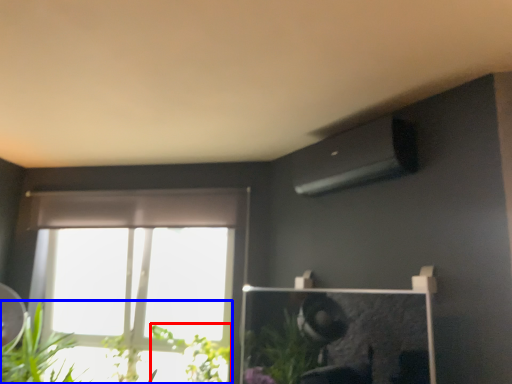
Question: Which point is closer to the camera, plant (highlighted by a red box) or houseplant (highlighted by a blue box)?

Choices:
 (A) plant
 (B) houseplant

Answer: (B)